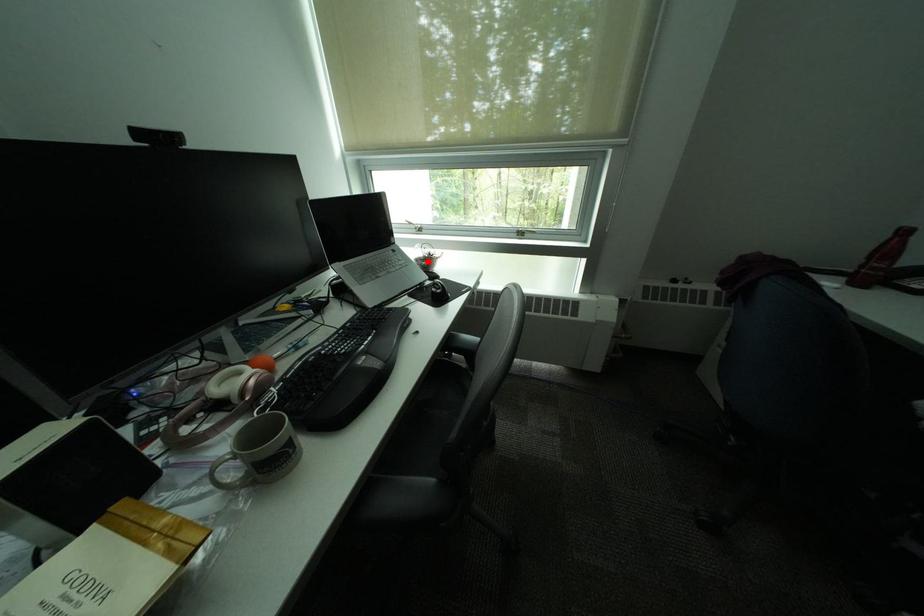
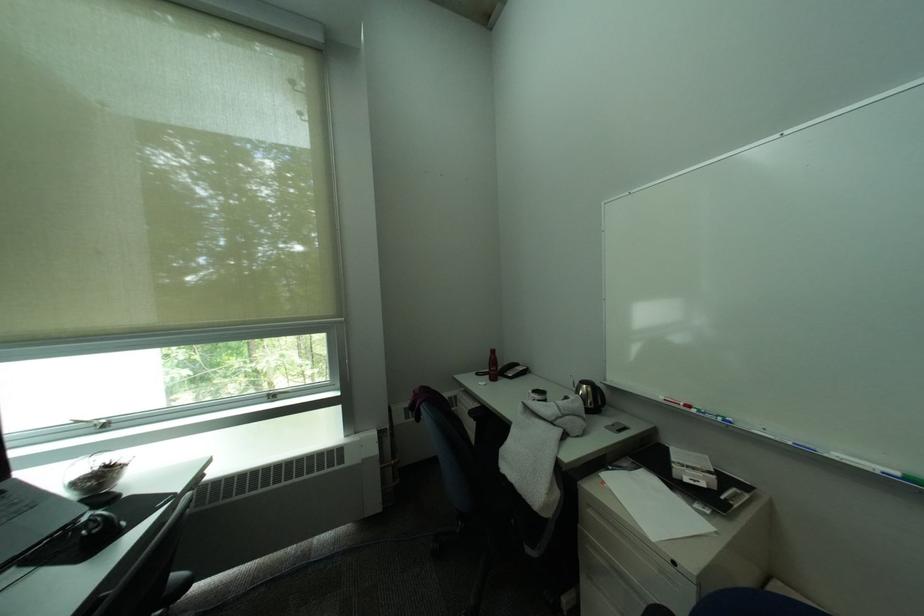
Question: I am providing you with two images of the same scene from different viewpoints. A red point is shown in image1. For the corresponding object point in image2, is it positioned nearer or farther from the camera?

Choices:
 (A) Nearer
 (B) Farther

Answer: (B)